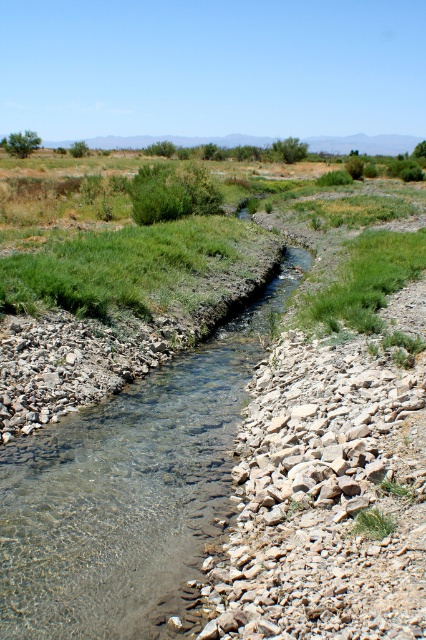
Which is more to the right, clear water stream at center or green leafy bush at upper left?

From the viewer's perspective, clear water stream at center appears more on the right side.

Which of these two, clear water stream at center or green leafy bush at upper left, stands shorter?

clear water stream at center is shorter.

I want to click on clear water stream at center, so click(127, 486).